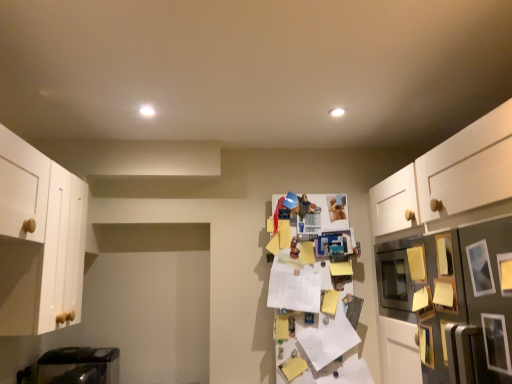
This screenshot has height=384, width=512. I want to click on white matte cabinet at left, so click(39, 240).

Looking at this image, what is the approximate width of metallic silver picture frame at right, marked as the 3th picture frame in a back-to-front arrangement?

The width of metallic silver picture frame at right, marked as the 3th picture frame in a back-to-front arrangement, is 2.31 inches.

Describe the element at coordinates (505, 273) in the screenshot. I see `wooden picture frame at right, the fifth picture frame viewed from the back` at that location.

What is the approximate width of wooden picture frame at lower right, arranged as the first picture frame when viewed from the back?

wooden picture frame at lower right, arranged as the first picture frame when viewed from the back, is 2.86 centimeters in width.

In order to face metallic silver refrigerator at right, the first shelf from the right, should I rotate leftwards or rightwards?

Rotate your view right by about 24.927°.

Where is `white matte cabinet at left`? white matte cabinet at left is located at coordinates (39, 240).

How much distance is there between metallic silver picture frame at right, which appears as the second picture frame when viewed from the front, and white matte cabinet at left?

metallic silver picture frame at right, which appears as the second picture frame when viewed from the front, and white matte cabinet at left are 5.49 feet apart.

Is point (485, 325) less distant than point (14, 204)?

Yes.

From a real-world perspective, does metallic silver picture frame at right, which appears as the second picture frame when viewed from the front, sit lower than white matte cabinet at left?

Yes, from a real-world perspective, metallic silver picture frame at right, which appears as the second picture frame when viewed from the front, is below white matte cabinet at left.

Considering the sizes of metallic silver picture frame at right, the 4th picture frame positioned from the back, and wooden picture frame at right, the fifth picture frame viewed from the back, in the image, is metallic silver picture frame at right, the 4th picture frame positioned from the back, taller or shorter than wooden picture frame at right, the fifth picture frame viewed from the back,?

Result: metallic silver picture frame at right, the 4th picture frame positioned from the back, is taller than wooden picture frame at right, the fifth picture frame viewed from the back.

Is metallic silver picture frame at right, which appears as the second picture frame when viewed from the front, inside or outside of wooden picture frame at right, the fifth picture frame viewed from the back?

metallic silver picture frame at right, which appears as the second picture frame when viewed from the front, is outside wooden picture frame at right, the fifth picture frame viewed from the back.

Which of these two, metallic silver picture frame at right, which appears as the second picture frame when viewed from the front, or wooden picture frame at right, the fifth picture frame viewed from the back, is bigger?

With larger size is wooden picture frame at right, the fifth picture frame viewed from the back.

From the image's perspective, which one is positioned lower, metallic silver picture frame at right, which appears as the second picture frame when viewed from the front, or wooden picture frame at right, which is the first picture frame in front-to-back order?

metallic silver picture frame at right, which appears as the second picture frame when viewed from the front, appears lower in the image.

Would you say wooden picture frame at lower right, arranged as the first picture frame when viewed from the back, contains wooden picture frame at right, the fifth picture frame viewed from the back?

No, wooden picture frame at right, the fifth picture frame viewed from the back, is located outside of wooden picture frame at lower right, arranged as the first picture frame when viewed from the back.

Is wooden picture frame at lower right, which is the fifth picture frame from front to back, oriented towards wooden picture frame at right, which is the first picture frame in front-to-back order?

No, wooden picture frame at lower right, which is the fifth picture frame from front to back, is not oriented towards wooden picture frame at right, which is the first picture frame in front-to-back order.

Is wooden picture frame at lower right, which is the fifth picture frame from front to back, taller or shorter than wooden picture frame at right, which is the first picture frame in front-to-back order?

In the image, wooden picture frame at lower right, which is the fifth picture frame from front to back, appears to be taller than wooden picture frame at right, which is the first picture frame in front-to-back order.

From the image's perspective, which picture frame is the 4th one above the wooden picture frame at lower right, arranged as the first picture frame when viewed from the back? Please provide its 2D coordinates.

[(505, 273)]

In the scene shown: Does metallic silver picture frame at right, the third picture frame positioned from the front, come behind yellow paper at center, the second shelf when ordered from front to back?

No, the depth of metallic silver picture frame at right, the third picture frame positioned from the front, is less than that of yellow paper at center, the second shelf when ordered from front to back.

Looking at their sizes, would you say metallic silver picture frame at right, marked as the 3th picture frame in a back-to-front arrangement, is wider or thinner than yellow paper at center, the second shelf when ordered from front to back?

Clearly, metallic silver picture frame at right, marked as the 3th picture frame in a back-to-front arrangement, has less width compared to yellow paper at center, the second shelf when ordered from front to back.

From the image's perspective, would you say metallic silver picture frame at right, the third picture frame positioned from the front, is shown under yellow paper at center, which appears as the first shelf when viewed from the back?

Incorrect, from the image's perspective, metallic silver picture frame at right, the third picture frame positioned from the front, is higher than yellow paper at center, which appears as the first shelf when viewed from the back.

Does point (489, 280) appear closer or farther from the camera than point (279, 253)?

Point (489, 280).

Looking at this image, which object is positioned more to the left, wooden picture frame at lower right, arranged as the first picture frame when viewed from the back, or wooden picture frame at right, acting as the 4th picture frame starting from the front?

Positioned to the left is wooden picture frame at lower right, arranged as the first picture frame when viewed from the back.

Is wooden picture frame at lower right, which is the fifth picture frame from front to back, taller than wooden picture frame at right, acting as the 4th picture frame starting from the front?

Yes.

Based on the photo, who is smaller, wooden picture frame at lower right, arranged as the first picture frame when viewed from the back, or wooden picture frame at right, the second picture frame when ordered from back to front?

With smaller size is wooden picture frame at right, the second picture frame when ordered from back to front.

Could you tell me if wooden picture frame at lower right, which is the fifth picture frame from front to back, is turned towards wooden picture frame at right, the second picture frame when ordered from back to front?

No, wooden picture frame at lower right, which is the fifth picture frame from front to back, is not facing towards wooden picture frame at right, the second picture frame when ordered from back to front.

What's the angular difference between white matte cabinet at left and wooden picture frame at right, which is the first picture frame in front-to-back order,'s facing directions?

178 degrees separate the facing orientations of white matte cabinet at left and wooden picture frame at right, which is the first picture frame in front-to-back order.

Looking at this image, is white matte cabinet at left wider than wooden picture frame at right, which is the first picture frame in front-to-back order?

Yes.

Can you confirm if white matte cabinet at left is positioned to the right of wooden picture frame at right, which is the first picture frame in front-to-back order?

In fact, white matte cabinet at left is to the left of wooden picture frame at right, which is the first picture frame in front-to-back order.

From a real-world perspective, which object stands above the other?

white matte cabinet at left, from a real-world perspective.

Is the surface of metallic silver picture frame at right, the 4th picture frame positioned from the back, in direct contact with yellow paper at center, marked as the second shelf in a right-to-left arrangement?

There is a gap between metallic silver picture frame at right, the 4th picture frame positioned from the back, and yellow paper at center, marked as the second shelf in a right-to-left arrangement.

From the image's perspective, between metallic silver picture frame at right, which appears as the second picture frame when viewed from the front, and yellow paper at center, which appears as the first shelf when viewed from the back, which one is located above?

metallic silver picture frame at right, which appears as the second picture frame when viewed from the front, from the image's perspective.

Considering their positions, is metallic silver picture frame at right, which appears as the second picture frame when viewed from the front, located in front of or behind yellow paper at center, the first shelf in the left-to-right sequence?

Visually, metallic silver picture frame at right, which appears as the second picture frame when viewed from the front, is located in front of yellow paper at center, the first shelf in the left-to-right sequence.

From the white matte cabinet at left, count 1st picture frames backward and point to it. Please provide its 2D coordinates.

[(496, 343)]

This screenshot has height=384, width=512. I want to click on picture frame that appears on the right of wooden picture frame at right, the fifth picture frame viewed from the back, so click(x=496, y=343).

From the image, which object appears to be nearer to metallic silver picture frame at right, the third picture frame positioned from the front, wooden picture frame at right, the second picture frame when ordered from back to front, or metallic silver refrigerator at right, the 2th shelf positioned from the back?

metallic silver refrigerator at right, the 2th shelf positioned from the back, lies closer to metallic silver picture frame at right, the third picture frame positioned from the front, than the other object.

Considering their positions, is metallic silver picture frame at right, the 4th picture frame positioned from the back, positioned closer to wooden picture frame at lower right, which is the fifth picture frame from front to back, than yellow paper at center, the second shelf when ordered from front to back?

Among the two, metallic silver picture frame at right, the 4th picture frame positioned from the back, is located nearer to wooden picture frame at lower right, which is the fifth picture frame from front to back.

From the image, which object appears to be nearer to metallic silver picture frame at right, marked as the 3th picture frame in a back-to-front arrangement, wooden picture frame at lower right, which is the fifth picture frame from front to back, or yellow paper at center, which appears as the first shelf when viewed from the back?

wooden picture frame at lower right, which is the fifth picture frame from front to back.

Considering their positions, is yellow paper at center, the first shelf in the left-to-right sequence, positioned closer to white matte cabinet at left than wooden picture frame at lower right, which is the fifth picture frame from front to back?

The object closer to white matte cabinet at left is yellow paper at center, the first shelf in the left-to-right sequence.

Considering their positions, is metallic silver refrigerator at right, the 2th shelf positioned from the back, positioned closer to wooden picture frame at right, acting as the 4th picture frame starting from the front, than metallic silver picture frame at right, marked as the 3th picture frame in a back-to-front arrangement?

Based on the image, metallic silver picture frame at right, marked as the 3th picture frame in a back-to-front arrangement, appears to be nearer to wooden picture frame at right, acting as the 4th picture frame starting from the front.

Based on their spatial positions, is wooden picture frame at lower right, which is the fifth picture frame from front to back, or yellow paper at center, marked as the second shelf in a right-to-left arrangement, further from metallic silver picture frame at right, which appears as the second picture frame when viewed from the front?

yellow paper at center, marked as the second shelf in a right-to-left arrangement.

Which object lies nearer to the anchor point metallic silver picture frame at right, marked as the 3th picture frame in a back-to-front arrangement, yellow paper at center, marked as the second shelf in a right-to-left arrangement, or metallic silver refrigerator at right, the 2th shelf positioned from the back?

metallic silver refrigerator at right, the 2th shelf positioned from the back, is positioned closer to the anchor metallic silver picture frame at right, marked as the 3th picture frame in a back-to-front arrangement.

From the image, which object appears to be farther from metallic silver refrigerator at right, arranged as the 1th shelf when viewed from the front, metallic silver picture frame at right, marked as the 3th picture frame in a back-to-front arrangement, or yellow paper at center, marked as the second shelf in a right-to-left arrangement?

yellow paper at center, marked as the second shelf in a right-to-left arrangement, lies further to metallic silver refrigerator at right, arranged as the 1th shelf when viewed from the front, than the other object.

Image resolution: width=512 pixels, height=384 pixels. In order to click on picture frame between wooden picture frame at right, acting as the 4th picture frame starting from the front, and yellow paper at center, the second shelf when ordered from front to back, along the z-axis in this screenshot , I will do `click(426, 345)`.

Locate an element on the screen. The image size is (512, 384). shelf between wooden picture frame at right, the fifth picture frame viewed from the back, and wooden picture frame at right, the second picture frame when ordered from back to front, in the front-back direction is located at coordinates (457, 302).

The height and width of the screenshot is (384, 512). I want to click on picture frame between white matte cabinet at left and metallic silver refrigerator at right, the 2th shelf positioned from the back, from left to right, so click(426, 345).

The height and width of the screenshot is (384, 512). I want to click on shelf between wooden picture frame at right, the fifth picture frame viewed from the back, and metallic silver picture frame at right, the third picture frame positioned from the front, from front to back, so click(457, 302).